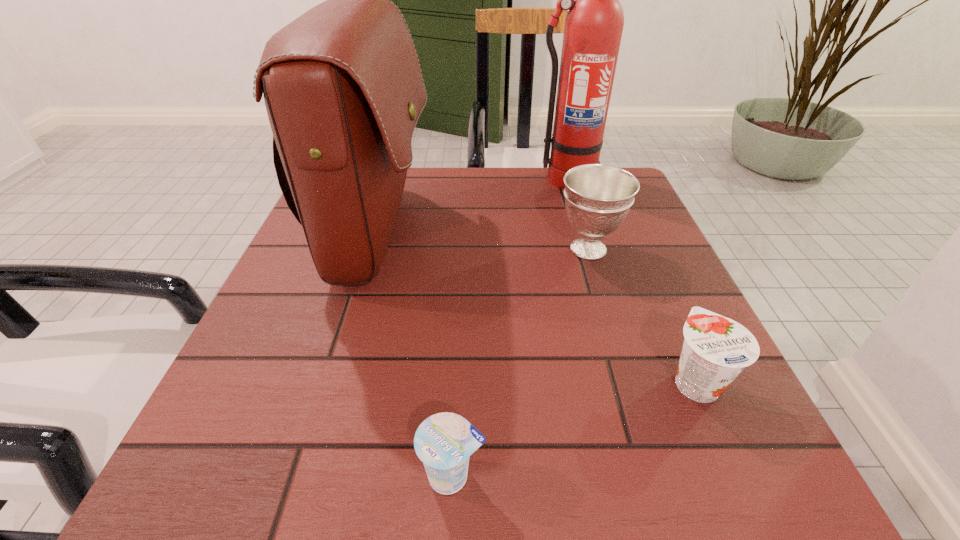
Find the location of a particular element. Image resolution: width=960 pixels, height=540 pixels. free location that satisfies the following two spatial constraints: 1. on the open flap of the satchel; 2. on the right side of the shorter yogurt is located at coordinates coord(305,475).